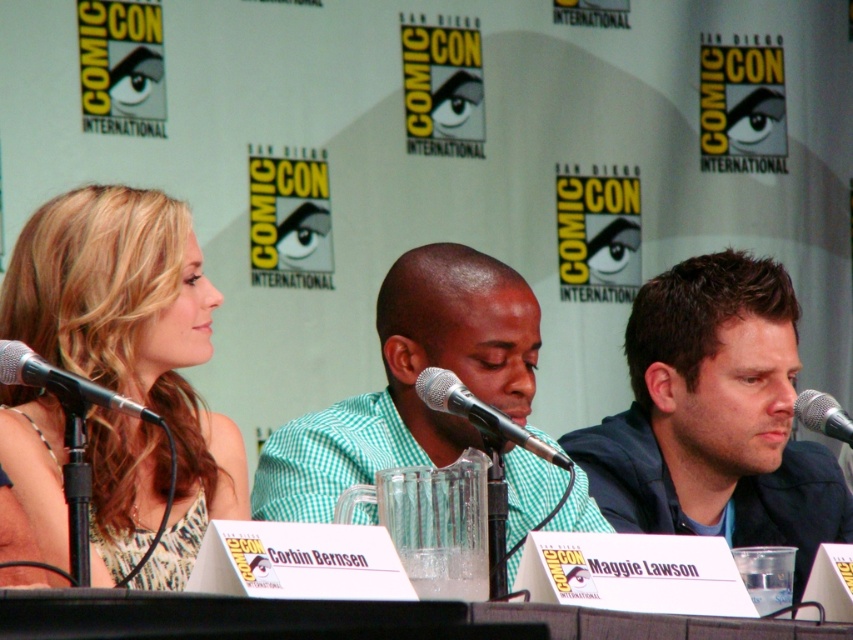
Locate an element on the screen. The width and height of the screenshot is (853, 640). dark blue hoodie at center is located at coordinates (715, 417).

Based on the photo, who is taller, dark blue hoodie at center or matte black microphone at left?

dark blue hoodie at center

The image size is (853, 640). I want to click on dark blue hoodie at center, so click(715, 417).

Can you confirm if blonde hair at center is taller than matte silver microphone at center?

Yes.

Is blonde hair at center positioned before matte silver microphone at center?

No, blonde hair at center is behind matte silver microphone at center.

Which is in front, point (18, 241) or point (486, 436)?

Positioned in front is point (486, 436).

I want to click on blonde hair at center, so click(x=132, y=339).

Which of these two, matte black microphone at left or black metallic microphone at right, stands taller?

matte black microphone at left

Which is above, matte black microphone at left or black metallic microphone at right?

matte black microphone at left

Where is `matte black microphone at left`? Image resolution: width=853 pixels, height=640 pixels. matte black microphone at left is located at coordinates (62, 384).